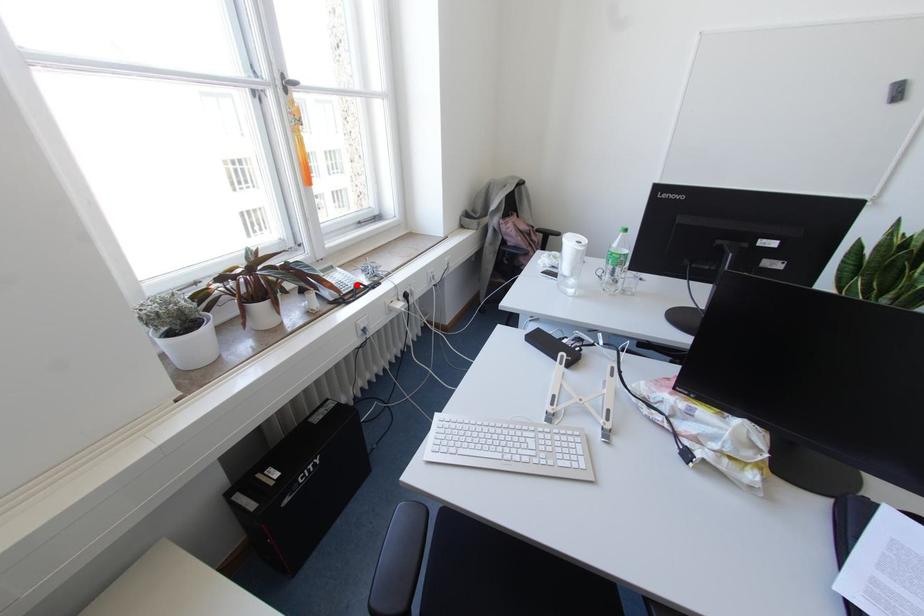
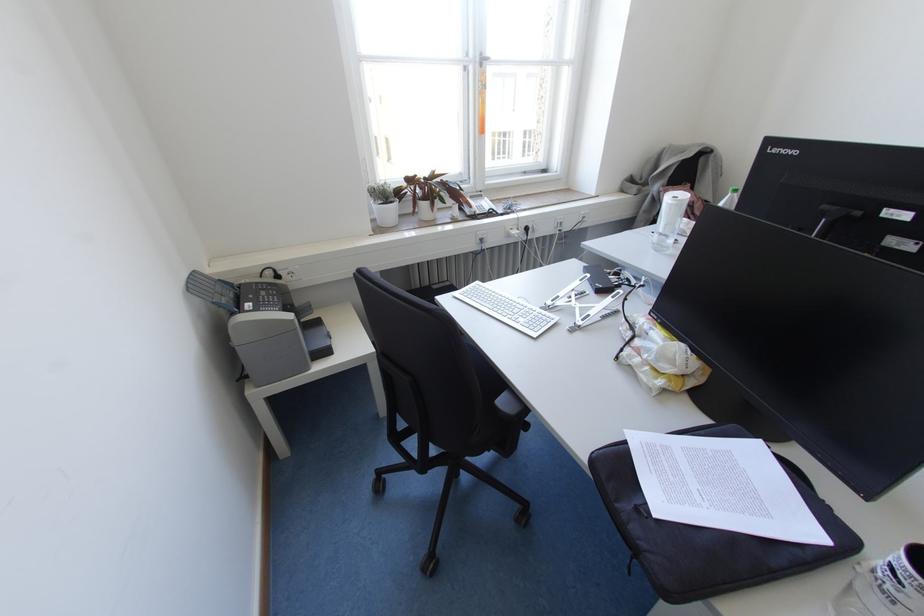
In the second image, find the point that corresponds to the highlighted location in the first image.

(490, 209)